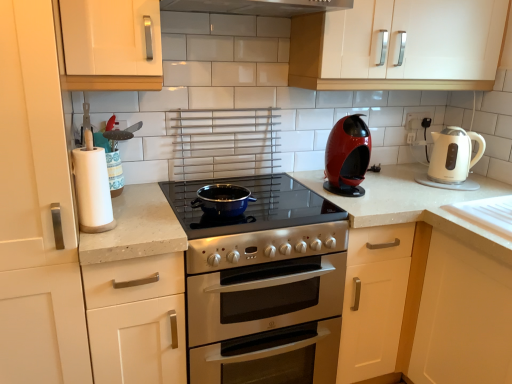
The width and height of the screenshot is (512, 384). What are the coordinates of `free space in front of white glossy electric kettle at right, placed as the 1th kitchen appliance when sorted from right to left` in the screenshot? It's located at (455, 194).